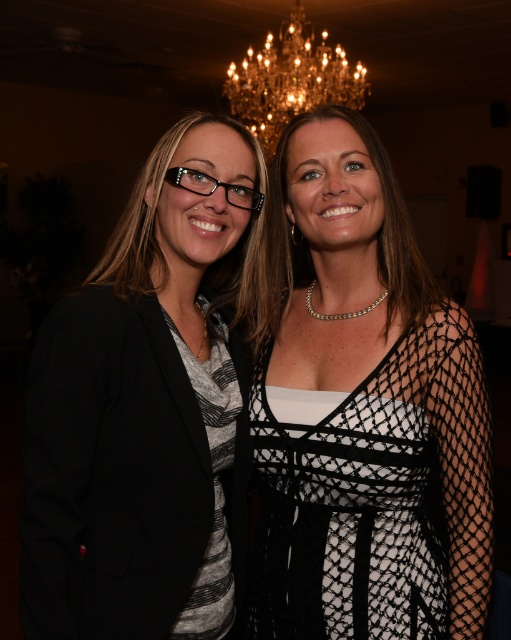
Is black mesh dress at center smaller than black matte blazer at left?

Yes, black mesh dress at center is smaller than black matte blazer at left.

Who is more distant from viewer, (404, 637) or (75, 540)?

The point (404, 637) is behind.

Where is `black mesh dress at center`? The height and width of the screenshot is (640, 511). black mesh dress at center is located at coordinates (364, 412).

Which is more to the left, black mesh dress at center or crystal chandelier at upper center?

black mesh dress at center is more to the left.

Does black mesh dress at center have a smaller size compared to crystal chandelier at upper center?

Yes, black mesh dress at center is smaller than crystal chandelier at upper center.

Between point (301, 451) and point (224, 83), which one is positioned behind?

The point (224, 83) is behind.

At what (x,y) coordinates should I click in order to perform the action: click on black mesh dress at center. Please return your answer as a coordinate pair (x, y). The image size is (511, 640). Looking at the image, I should click on (364, 412).

Which is in front, point (191, 492) or point (355, 106)?

Point (191, 492)

Does point (204, 394) come closer to viewer compared to point (243, 122)?

Yes, point (204, 394) is in front of point (243, 122).

Describe the element at coordinates (148, 410) in the screenshot. I see `black matte blazer at left` at that location.

In order to click on black matte blazer at left in this screenshot , I will do click(148, 410).